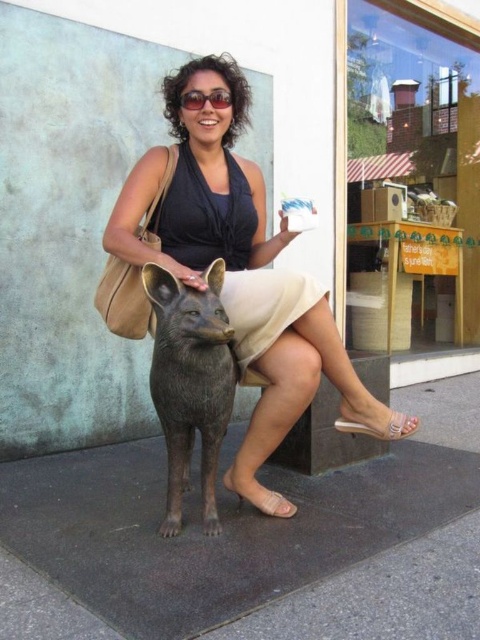
You are a delivery robot with a package that needs to be placed between the bronze statue at center and the beige satin dress at center. The package is 10 inches long. Will it fit in the space between them?

The distance between the bronze statue at center and the beige satin dress at center is 9.53 inches. Since the package is 10 inches long, it will not fit in the space between them as it is slightly longer than the available gap.

You are an artist observing the scene. You need to paint the woman wearing the matte black dress at center and the bronze statue at center. Which object should you paint first if you want to emphasize the size difference between them?

You should paint the matte black dress at center first because it has a larger size compared to the bronze statue at center, allowing you to establish the scale relationship early in your painting.

What are the coordinates of the matte black dress at center?

The matte black dress at center is located at point (240, 269).